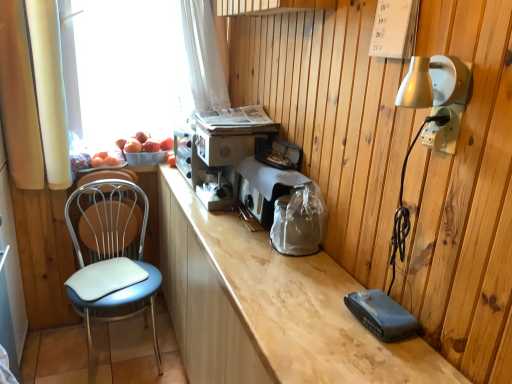
Question: Choose the correct answer: Is white plastic electrical outlet at upper right inside transparent plastic basket at upper left or outside it?

Choices:
 (A) inside
 (B) outside

Answer: (B)

Question: From the image's perspective, is white plastic electrical outlet at upper right above or below transparent plastic basket at upper left?

Choices:
 (A) below
 (B) above

Answer: (A)

Question: Considering the real-world distances, which object is closest to the white leather chair at left?

Choices:
 (A) metallic silver toaster at center
 (B) transparent plastic basket at upper left
 (C) white paper calendar at upper right
 (D) metallic silver coffee machine at center
 (E) white fabric curtain at left

Answer: (E)

Question: Which of these objects is positioned closest to the metallic silver coffee machine at center?

Choices:
 (A) metallic silver toaster at center
 (B) white fabric curtain at left
 (C) transparent plastic basket at upper left
 (D) white leather chair at left
 (E) blue padded seat at left

Answer: (A)